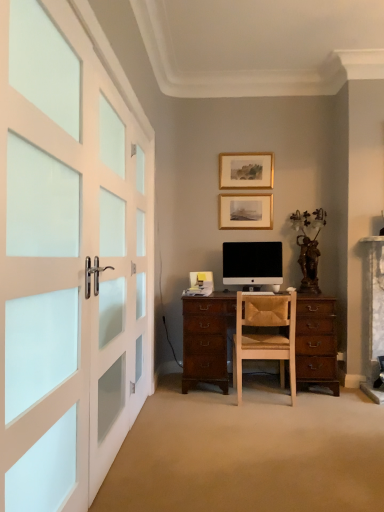
Question: Considering the relative sizes of gold/glossy picture frame at upper center, which is the second picture frame in bottom-to-top order, and wooden picture frame at center, marked as the first picture frame in a bottom-to-top arrangement, in the image provided, is gold/glossy picture frame at upper center, which is the second picture frame in bottom-to-top order, taller than wooden picture frame at center, marked as the first picture frame in a bottom-to-top arrangement,?

Choices:
 (A) no
 (B) yes

Answer: (A)

Question: Does gold/glossy picture frame at upper center, which is the second picture frame in bottom-to-top order, appear on the right side of wooden picture frame at center, which ranks as the second picture frame in top-to-bottom order?

Choices:
 (A) yes
 (B) no

Answer: (B)

Question: Would you say gold/glossy picture frame at upper center, which is the second picture frame in bottom-to-top order, is a long distance from wooden picture frame at center, marked as the first picture frame in a bottom-to-top arrangement?

Choices:
 (A) no
 (B) yes

Answer: (A)

Question: Is gold/glossy picture frame at upper center, which appears as the 1th picture frame when viewed from the top, surrounding wooden picture frame at center, marked as the first picture frame in a bottom-to-top arrangement?

Choices:
 (A) yes
 (B) no

Answer: (B)

Question: Considering the relative sizes of gold/glossy picture frame at upper center, which is the second picture frame in bottom-to-top order, and wooden picture frame at center, which ranks as the second picture frame in top-to-bottom order, in the image provided, is gold/glossy picture frame at upper center, which is the second picture frame in bottom-to-top order, shorter than wooden picture frame at center, which ranks as the second picture frame in top-to-bottom order,?

Choices:
 (A) no
 (B) yes

Answer: (B)

Question: Do you think light brown wood chair at center is within gold/glossy picture frame at upper center, which appears as the 1th picture frame when viewed from the top, or outside of it?

Choices:
 (A) inside
 (B) outside

Answer: (B)

Question: Considering the positions of light brown wood chair at center and gold/glossy picture frame at upper center, which is the second picture frame in bottom-to-top order, in the image, is light brown wood chair at center taller or shorter than gold/glossy picture frame at upper center, which is the second picture frame in bottom-to-top order,?

Choices:
 (A) short
 (B) tall

Answer: (B)

Question: From the image's perspective, is light brown wood chair at center located above or below gold/glossy picture frame at upper center, which is the second picture frame in bottom-to-top order?

Choices:
 (A) below
 (B) above

Answer: (A)

Question: From a real-world perspective, relative to gold/glossy picture frame at upper center, which is the second picture frame in bottom-to-top order, is light brown wood chair at center vertically above or below?

Choices:
 (A) above
 (B) below

Answer: (B)

Question: From the image's perspective, is white frosted glass doors at left located above or below light brown wood chair at center?

Choices:
 (A) below
 (B) above

Answer: (B)

Question: Visually, is white frosted glass doors at left positioned to the left or to the right of light brown wood chair at center?

Choices:
 (A) right
 (B) left

Answer: (B)

Question: Does point (x=14, y=291) appear closer or farther from the camera than point (x=291, y=388)?

Choices:
 (A) closer
 (B) farther

Answer: (A)

Question: Looking at their shapes, would you say white frosted glass doors at left is wider or thinner than light brown wood chair at center?

Choices:
 (A) wide
 (B) thin

Answer: (B)

Question: Is light brown wood chair at center in front of or behind black matte computer monitor at center in the image?

Choices:
 (A) front
 (B) behind

Answer: (A)

Question: From a real-world perspective, is light brown wood chair at center physically located above or below black matte computer monitor at center?

Choices:
 (A) above
 (B) below

Answer: (B)